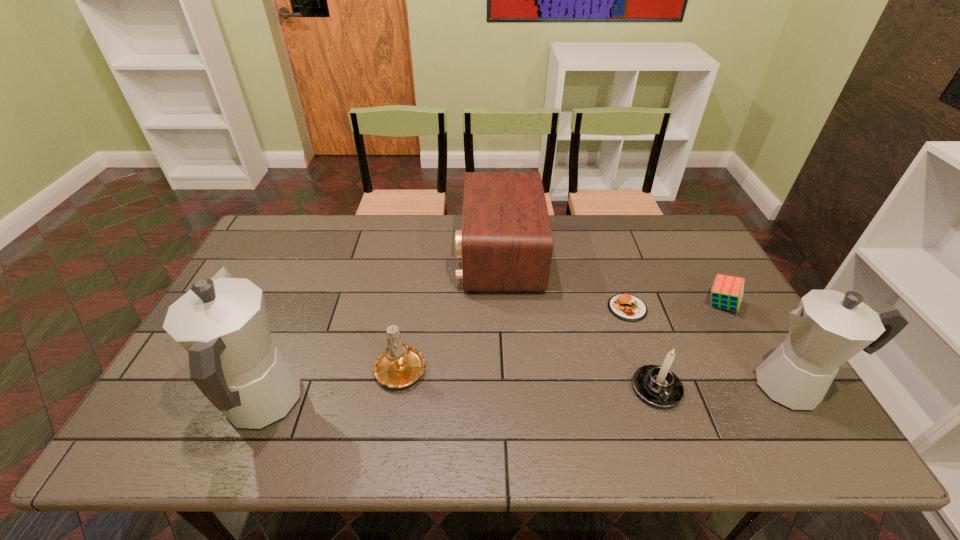
In the image, there is a desktop. Where is `vacant space at the far left corner`? vacant space at the far left corner is located at coordinates 276,228.

The width and height of the screenshot is (960, 540). I want to click on free space at the far right corner, so click(x=661, y=251).

Identify the location of free point between the right coffeepot and the patty (food). (709, 347).

You are a GUI agent. You are given a task and a screenshot of the screen. Output one action in this format:
    pyautogui.click(x=<x>, y=<y>)
    Task: Click on the empty location between the shortest object and the second shortest object
    The image size is (960, 540).
    Given the screenshot: What is the action you would take?
    pyautogui.click(x=674, y=306)

Identify the location of free spot between the candle and the right coffeepot. 597,376.

What are the coordinates of `free space between the candle holder and the left coffeepot` in the screenshot? It's located at (459, 396).

In order to click on free spot between the patty (food) and the third object from left to right in this screenshot , I will do `click(564, 282)`.

You are a GUI agent. You are given a task and a screenshot of the screen. Output one action in this format:
    pyautogui.click(x=<x>, y=<y>)
    Task: Click on the blank region between the left coffeepot and the shortest object
    The height and width of the screenshot is (540, 960).
    Given the screenshot: What is the action you would take?
    pyautogui.click(x=444, y=356)

Locate an element on the screen. unoccupied area between the third tallest object and the patty (food) is located at coordinates (564, 282).

Image resolution: width=960 pixels, height=540 pixels. I want to click on vacant point located between the shorter coffeepot and the radio receiver, so click(x=646, y=321).